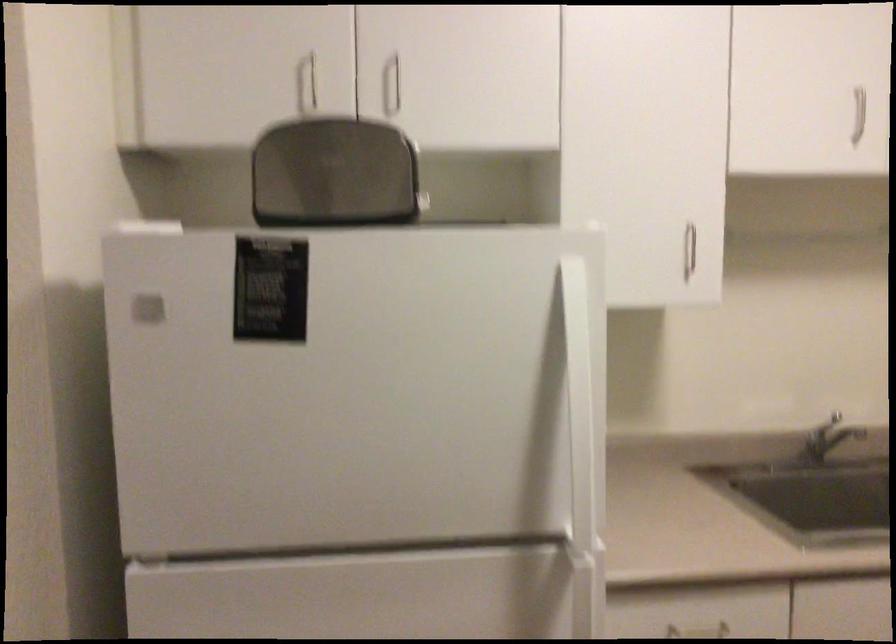
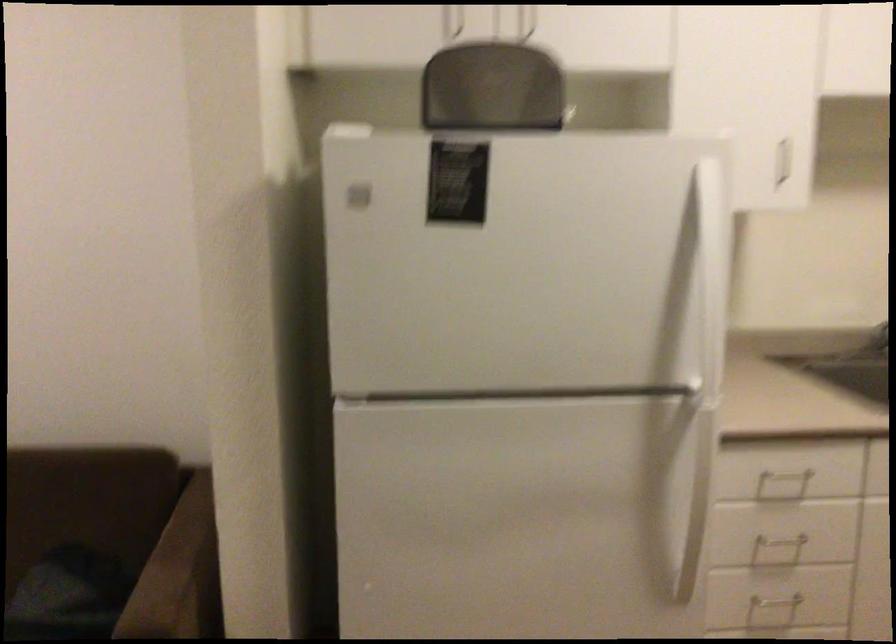
Question: Based on the continuous images, in which direction is the camera rotating? Reply with the corresponding letter.

Choices:
 (A) Left
 (B) Right
 (C) Up
 (D) Down

Answer: (D)